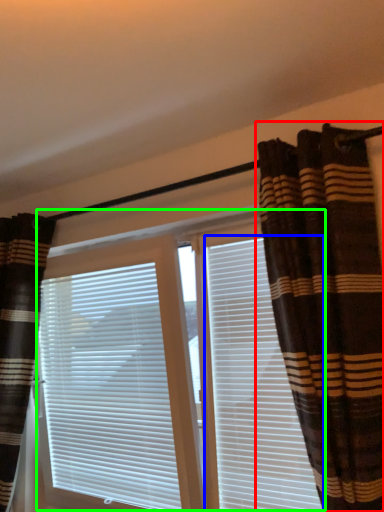
Question: Which is nearer to the curtain (highlighted by a red box)? shutter (highlighted by a blue box) or bay window (highlighted by a green box).

Choices:
 (A) shutter
 (B) bay window

Answer: (A)